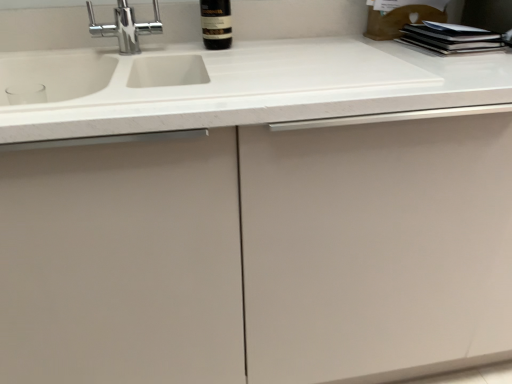
Question: Considering the relative sizes of dark glass bottle at upper center and white matte countertop at center in the image provided, is dark glass bottle at upper center thinner than white matte countertop at center?

Choices:
 (A) no
 (B) yes

Answer: (B)

Question: Is dark glass bottle at upper center taller than white matte countertop at center?

Choices:
 (A) no
 (B) yes

Answer: (B)

Question: Are dark glass bottle at upper center and white matte countertop at center located far from each other?

Choices:
 (A) yes
 (B) no

Answer: (B)

Question: From a real-world perspective, is dark glass bottle at upper center over white matte countertop at center?

Choices:
 (A) no
 (B) yes

Answer: (B)

Question: Is dark glass bottle at upper center bigger than white matte countertop at center?

Choices:
 (A) no
 (B) yes

Answer: (A)

Question: Is the position of dark glass bottle at upper center less distant than that of white matte countertop at center?

Choices:
 (A) yes
 (B) no

Answer: (B)

Question: Does white matte countertop at center contain dark glass bottle at upper center?

Choices:
 (A) yes
 (B) no

Answer: (B)

Question: Are white matte countertop at center and dark glass bottle at upper center located far from each other?

Choices:
 (A) yes
 (B) no

Answer: (B)

Question: Is white matte countertop at center touching dark glass bottle at upper center?

Choices:
 (A) yes
 (B) no

Answer: (B)

Question: Is the depth of white matte countertop at center less than that of dark glass bottle at upper center?

Choices:
 (A) no
 (B) yes

Answer: (B)

Question: Is white matte countertop at center aimed at dark glass bottle at upper center?

Choices:
 (A) yes
 (B) no

Answer: (B)

Question: From a real-world perspective, is white matte countertop at center on top of dark glass bottle at upper center?

Choices:
 (A) no
 (B) yes

Answer: (A)

Question: Would you say dark glass bottle at upper center is to the left or to the right of white matte countertop at center in the picture?

Choices:
 (A) right
 (B) left

Answer: (A)